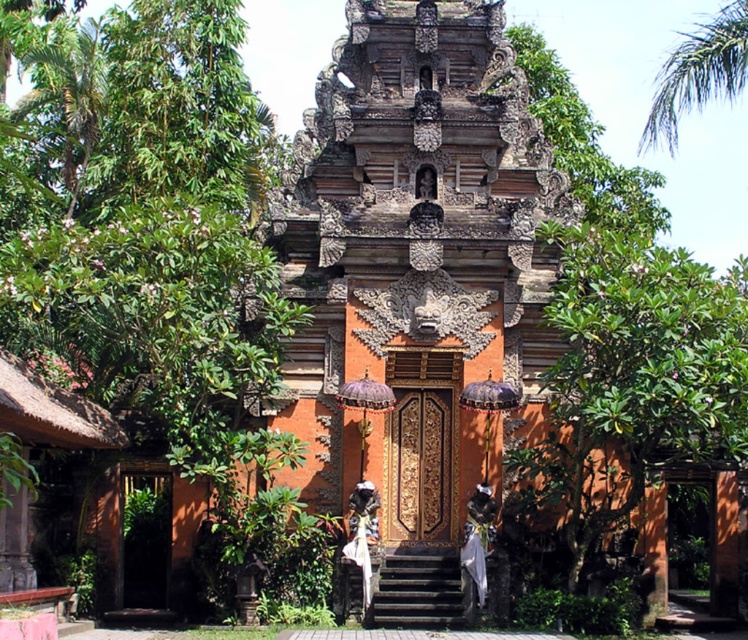
Question: Which point is closer to the camera?

Choices:
 (A) white cloth at center
 (B) green leafy tree at center
 (C) terracotta stone temple at center
 (D) white cloth statue at center

Answer: (B)

Question: Estimate the real-world distances between objects in this image. Which object is closer to the white cloth at center?

Choices:
 (A) green leafy tree at center
 (B) terracotta stone temple at center

Answer: (A)

Question: Can you confirm if green leafy tree at center is positioned above white cloth at center?

Choices:
 (A) no
 (B) yes

Answer: (B)

Question: Does white cloth statue at center appear on the right side of white cloth at center?

Choices:
 (A) no
 (B) yes

Answer: (B)

Question: Which object appears closest to the camera in this image?

Choices:
 (A) white cloth at center
 (B) white cloth statue at center

Answer: (B)

Question: Is terracotta stone temple at center below white cloth statue at center?

Choices:
 (A) no
 (B) yes

Answer: (A)